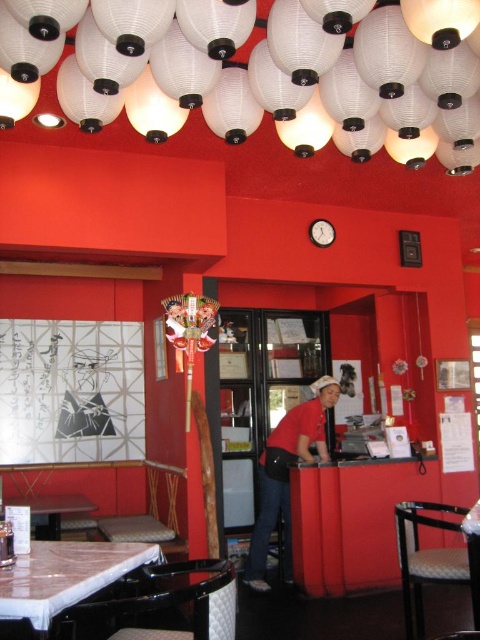
Does white marble table at lower left appear on the right side of marble top table at lower left?

Correct, you'll find white marble table at lower left to the right of marble top table at lower left.

Does white marble table at lower left have a smaller size compared to marble top table at lower left?

Correct, white marble table at lower left occupies less space than marble top table at lower left.

You are a GUI agent. You are given a task and a screenshot of the screen. Output one action in this format:
    pyautogui.click(x=<x>, y=<y>)
    Task: Click on the white marble table at lower left
    The image size is (480, 640).
    Given the screenshot: What is the action you would take?
    pyautogui.click(x=66, y=576)

You are a GUI agent. You are given a task and a screenshot of the screen. Output one action in this format:
    pyautogui.click(x=<x>, y=<y>)
    Task: Click on the white marble table at lower left
    
    Given the screenshot: What is the action you would take?
    pyautogui.click(x=66, y=576)

Is red matte shirt at center bigger than marble top table at lower left?

Yes, red matte shirt at center is bigger than marble top table at lower left.

Is red matte shirt at center wider than marble top table at lower left?

Incorrect, red matte shirt at center's width does not surpass marble top table at lower left's.

Who is more forward, (x=304, y=451) or (x=60, y=529)?

Point (x=60, y=529) is more forward.

Find the location of a particular element. red matte shirt at center is located at coordinates (287, 476).

Which of these two, white marble table at lower left or red matte shirt at center, stands taller?

red matte shirt at center is taller.

Between white marble table at lower left and red matte shirt at center, which one appears on the left side from the viewer's perspective?

white marble table at lower left

What do you see at coordinates (66, 576) in the screenshot? I see `white marble table at lower left` at bounding box center [66, 576].

Identify the location of white marble table at lower left. The image size is (480, 640). (66, 576).